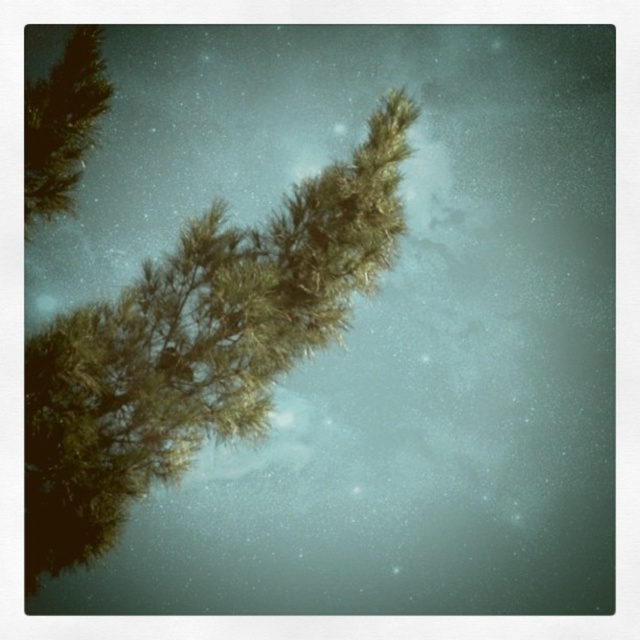
Question: Which object is farther from the camera taking this photo?

Choices:
 (A) green matte tree branch at upper left
 (B) green textured pine branch at upper left

Answer: (A)

Question: Which point is farther to the camera?

Choices:
 (A) green matte tree branch at upper left
 (B) green textured pine branch at upper left

Answer: (A)

Question: Is green textured pine branch at upper left positioned behind green matte tree branch at upper left?

Choices:
 (A) yes
 (B) no

Answer: (B)

Question: Is green textured pine branch at upper left smaller than green matte tree branch at upper left?

Choices:
 (A) yes
 (B) no

Answer: (A)

Question: Can you confirm if green textured pine branch at upper left is thinner than green matte tree branch at upper left?

Choices:
 (A) yes
 (B) no

Answer: (A)